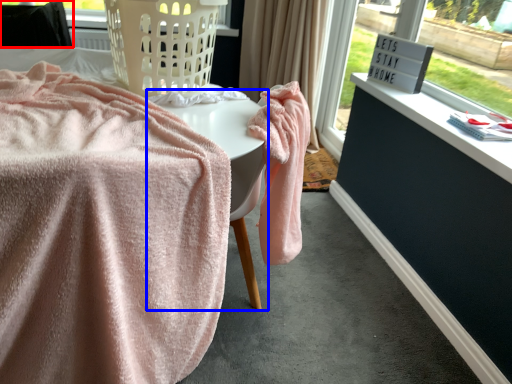
Question: Which of the following is the closest to the observer, furniture (highlighted by a red box) or table (highlighted by a blue box)?

Choices:
 (A) furniture
 (B) table

Answer: (B)